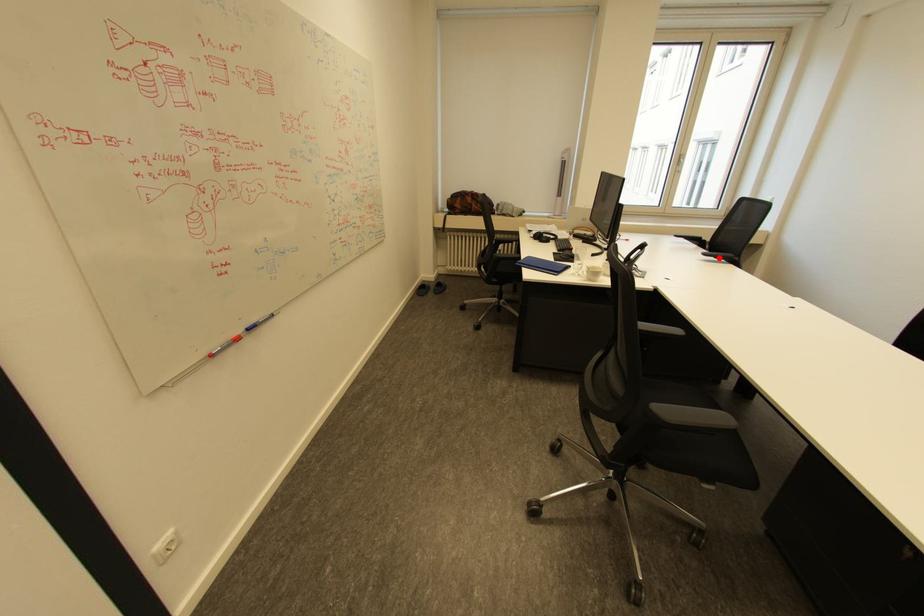
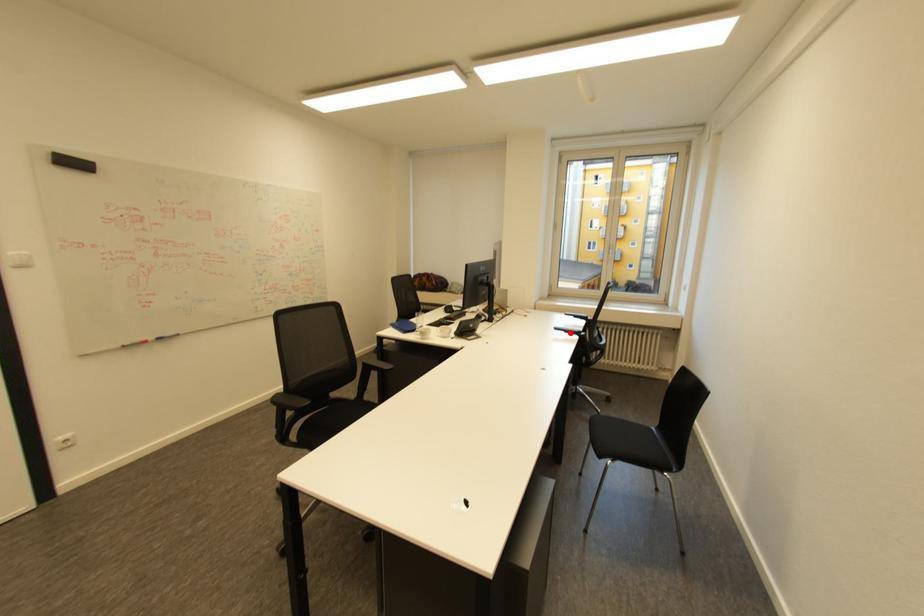
In the scene shown: I am providing you with two images of the same scene from different viewpoints. A red point is marked on the first image and another point is marked on the second image. Is the red point in image1 aligned with the point shown in image2?

Yes